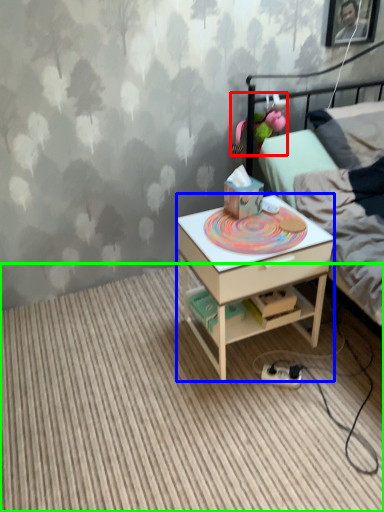
Question: Estimate the real-world distances between objects in this image. Which object is farther from toy (highlighted by a red box), desk (highlighted by a blue box) or plain (highlighted by a green box)?

Choices:
 (A) desk
 (B) plain

Answer: (B)